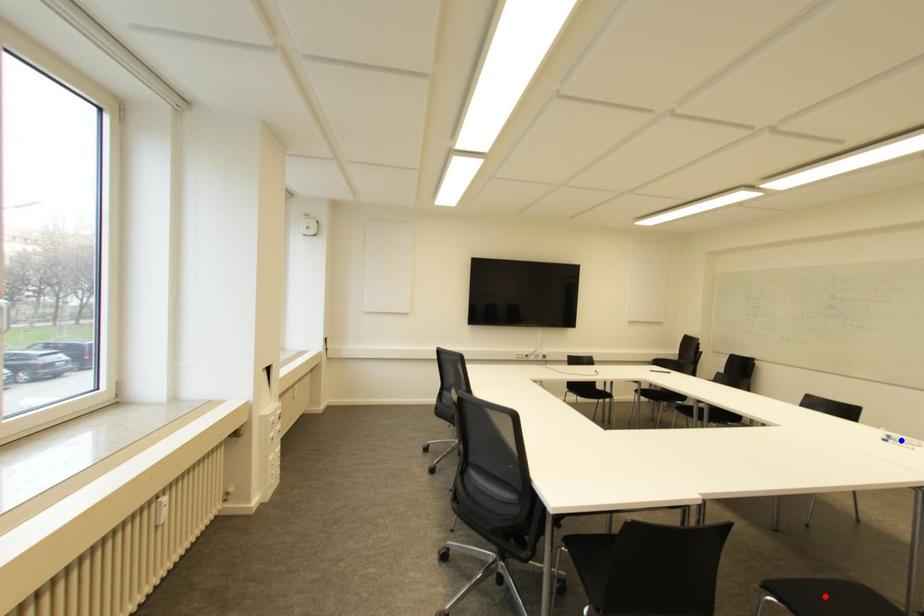
Question: Two points are marked on the image. Which point is closer to the camera?

Choices:
 (A) Blue point is closer.
 (B) Red point is closer.

Answer: (B)